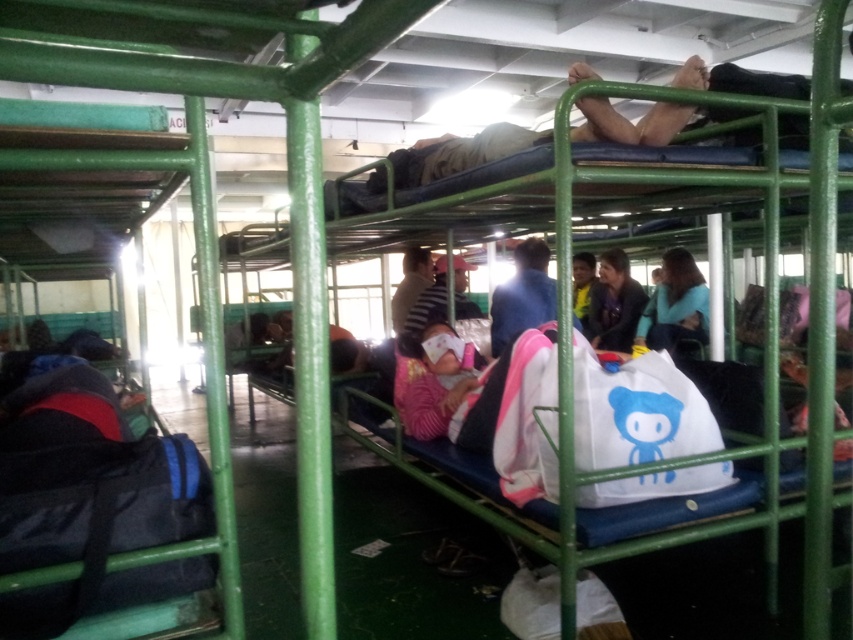
You are standing in the shared sleeping area of a ferry and notice a blue fabric somewhere in the center. Can you confirm if the point at coordinates (521, 296) corresponds to the location of the blue fabric at center?

Yes, the point at coordinates (521, 296) marks the blue fabric at center as per the description.